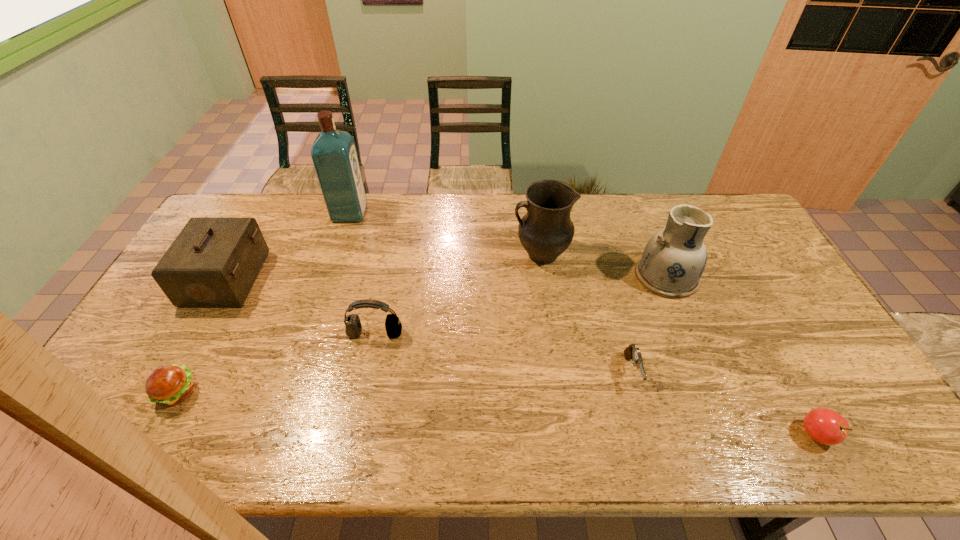
At what (x,y) coordinates should I click in order to perform the action: click on the farthest object. Please return your answer as a coordinate pair (x, y). The width and height of the screenshot is (960, 540). Looking at the image, I should click on (334, 155).

Locate an element on the screen. liquor is located at coordinates (334, 155).

Image resolution: width=960 pixels, height=540 pixels. In order to click on the second object from right to left in this screenshot , I will do `click(674, 259)`.

Where is `the fourth object from right to left`? the fourth object from right to left is located at coordinates (546, 231).

I want to click on the first-aid kit, so click(213, 262).

At what (x,y) coordinates should I click in order to perform the action: click on the fourth nearest object. Please return your answer as a coordinate pair (x, y). Image resolution: width=960 pixels, height=540 pixels. Looking at the image, I should click on (393, 326).

Find the location of `the fifth tallest object`. the fifth tallest object is located at coordinates (393, 326).

Where is `pistol`? Image resolution: width=960 pixels, height=540 pixels. pistol is located at coordinates coord(631,352).

Image resolution: width=960 pixels, height=540 pixels. What are the coordinates of `hamburger` in the screenshot? It's located at (170, 385).

Where is `the nearest object`? This screenshot has height=540, width=960. the nearest object is located at coordinates (825, 426).